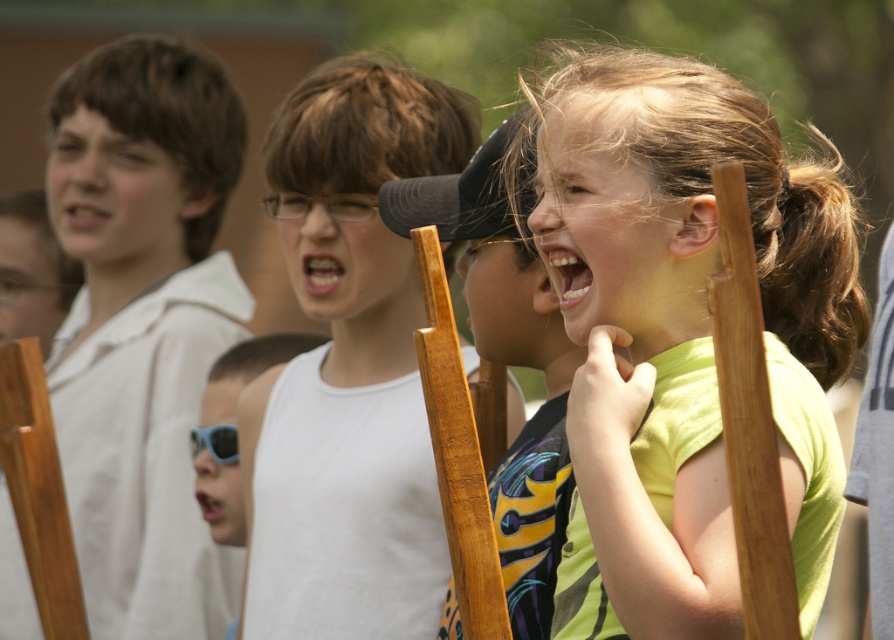
Between point (616, 275) and point (197, 458), which one is positioned behind?

Point (197, 458)

Is point (655, 428) farther from camera compared to point (226, 481)?

That is False.

Does point (675, 193) lie in front of point (242, 541)?

Yes.

This screenshot has height=640, width=894. I want to click on green matte shirt at center, so click(682, 336).

Is white matte tank top at center positioned behind blue plastic sunglasses at center?

No, it is in front of blue plastic sunglasses at center.

Describe the element at coordinates (348, 368) in the screenshot. This screenshot has height=640, width=894. I see `white matte tank top at center` at that location.

Where is `white matte tank top at center`? The height and width of the screenshot is (640, 894). white matte tank top at center is located at coordinates (348, 368).

Is point (848, 353) more distant than point (382, 541)?

No.

Does green matte shirt at center appear over white matte tank top at center?

No.

Between point (808, 480) and point (309, 205), which one is positioned behind?

Positioned behind is point (309, 205).

You are a GUI agent. You are given a task and a screenshot of the screen. Output one action in this format:
    pyautogui.click(x=<x>, y=<y>)
    Task: Click on the green matte shirt at center
    
    Given the screenshot: What is the action you would take?
    pyautogui.click(x=682, y=336)